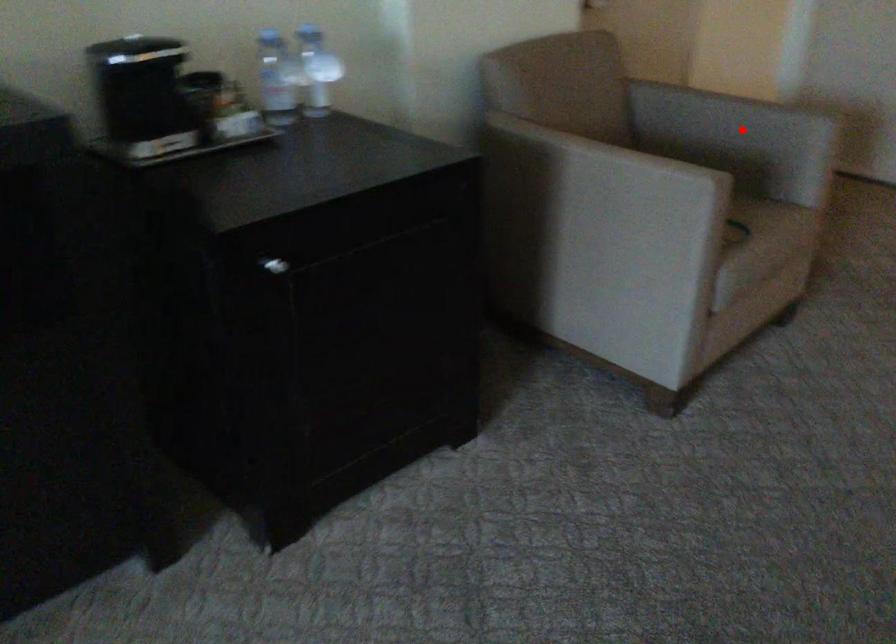
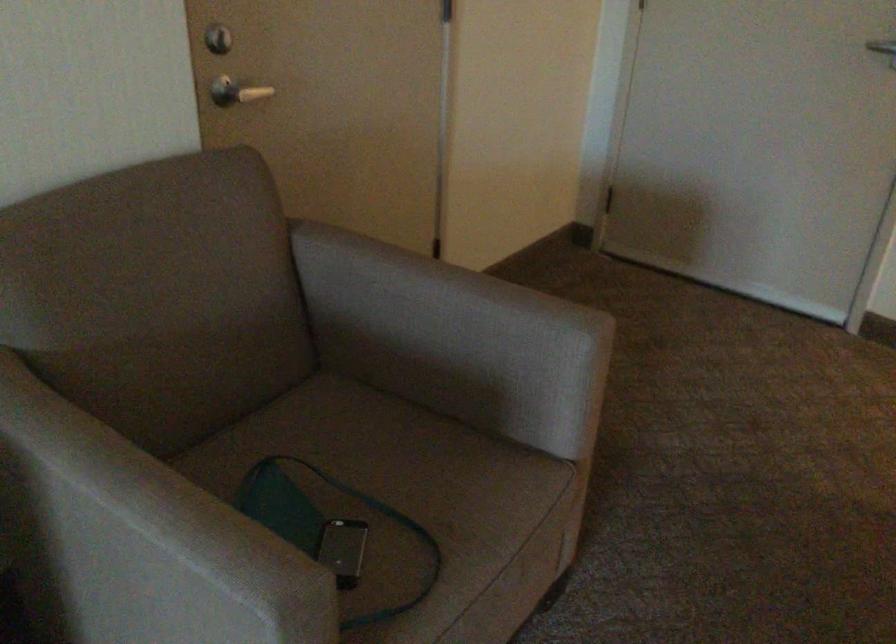
The point at the highlighted location is marked in the first image. Where is the corresponding point in the second image?

(453, 339)